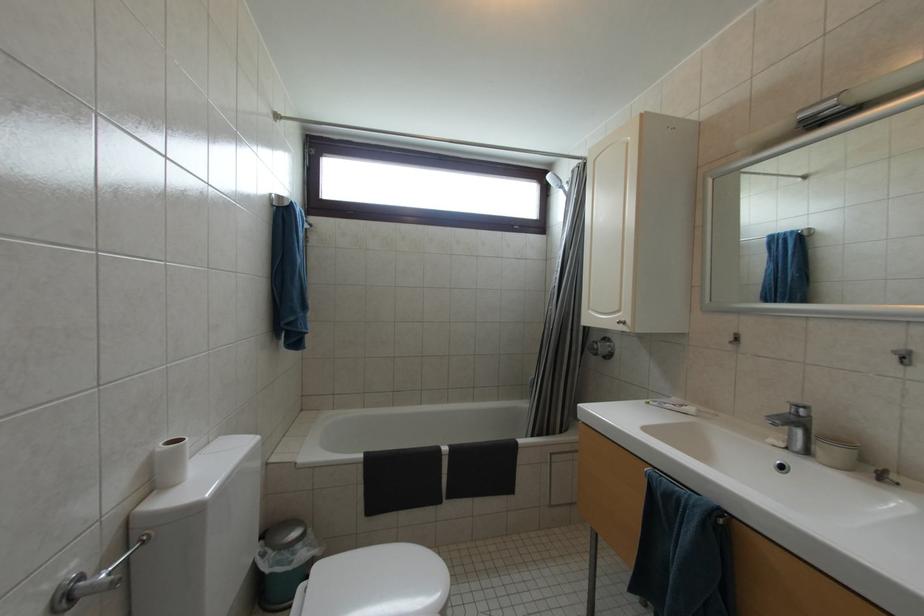
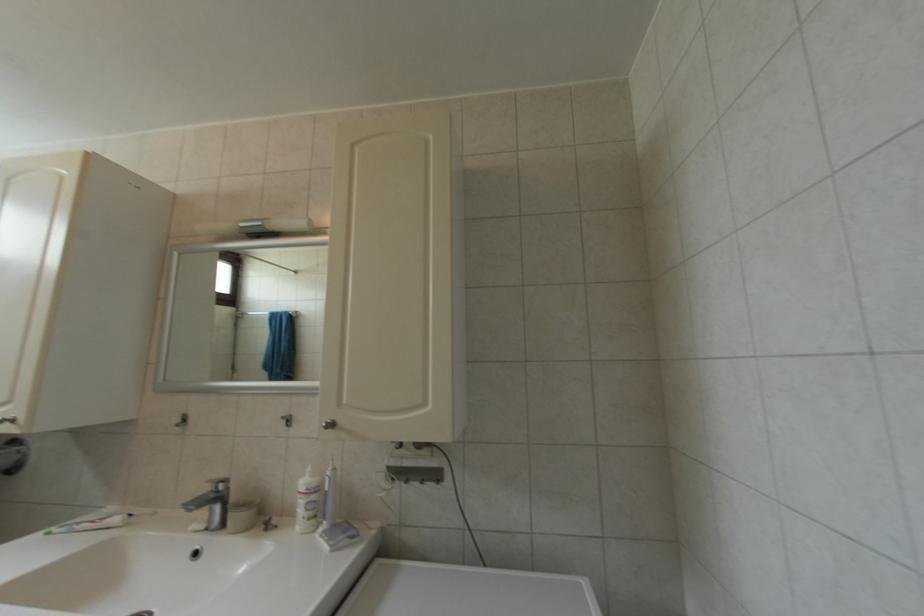
Question: The images are taken continuously from a first-person perspective. In which direction is your viewpoint rotating?

Choices:
 (A) Left
 (B) Right
 (C) Up
 (D) Down

Answer: (B)